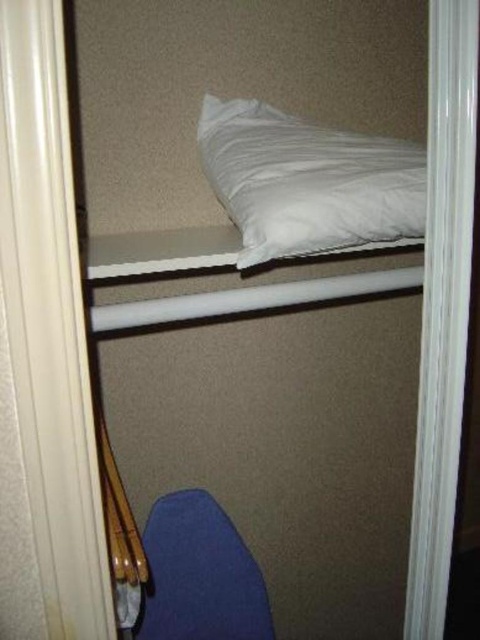
You are organizing the storage area and need to place a new item. The white soft pillow at upper center and the blue fabric chair at lower center are already present. Can you place a taller item between them without moving the existing objects?

The white soft pillow at upper center is positioned over the blue fabric chair at lower center, meaning there is no space between them for placing a taller item without moving the existing objects.

You are trying to determine if the blue fabric chair at lower center can fit through a doorway that is narrower than the white matte pillow at upper center. Based on their widths, can it pass through?

The blue fabric chair at lower center has a lesser width compared to the white matte pillow at upper center. Since the doorway is narrower than the pillow, the chair may still be too wide to fit through. However, without knowing the exact dimensions of the doorway and the chair, it is uncertain. Please measure both to confirm.